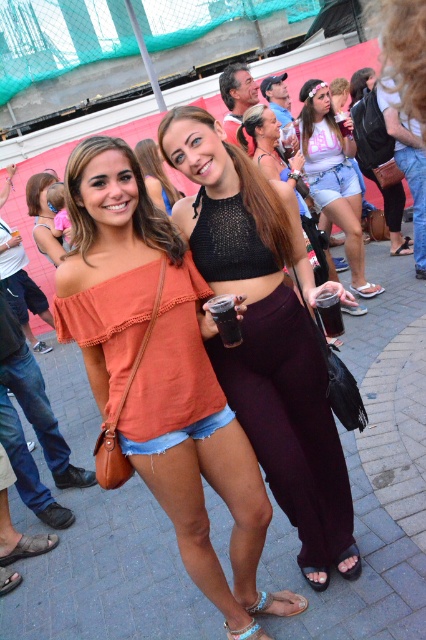
You are a photographer trying to capture a closeup of the blue fabric sandal at lower center without including the white matte shorts at center in the frame. Is this possible given their positions?

The white matte shorts at center is positioned over the blue fabric sandal at lower center, so it would block the view of the sandal. Therefore, it is not possible to capture a closeup of the blue fabric sandal at lower center without including the white matte shorts at center in the frame.

You are a photographer trying to capture a closeup shot of the white matte shorts at center and the blue fabric sandal at lower center. Since the camera has a limited focus range, you need to know which object is wider to ensure proper framing. Which one has a greater width?

The white matte shorts at center has a greater width than the blue fabric sandal at lower center according to the description.